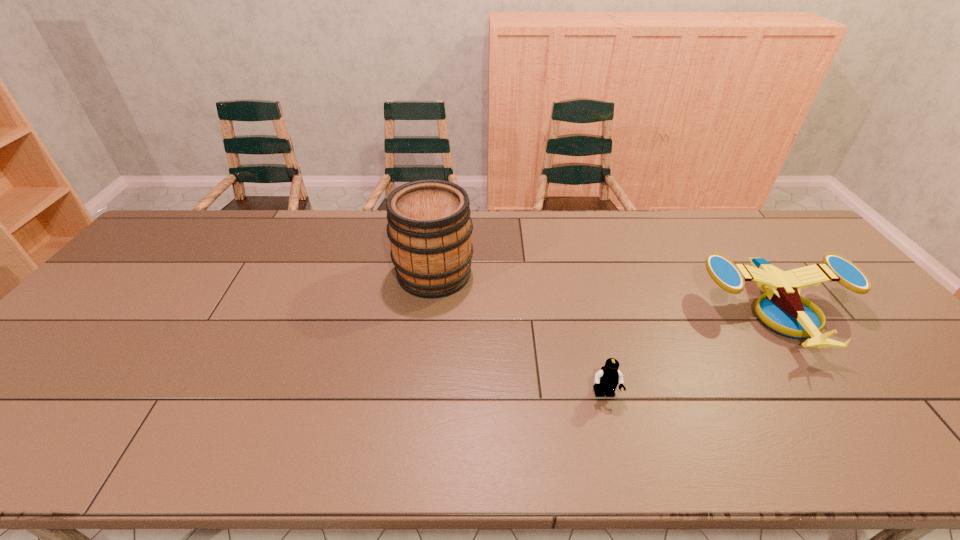
Image resolution: width=960 pixels, height=540 pixels. In the image, there is a desktop. Find the location of `vacant space at the far edge`. vacant space at the far edge is located at coordinates (263, 217).

Identify the location of free space at the near edge of the desktop. (422, 448).

You are a GUI agent. You are given a task and a screenshot of the screen. Output one action in this format:
    pyautogui.click(x=<x>, y=<y>)
    Task: Click on the free space at the right edge of the desktop
    This screenshot has width=960, height=540.
    Given the screenshot: What is the action you would take?
    pyautogui.click(x=919, y=374)

The height and width of the screenshot is (540, 960). I want to click on vacant space at the far left corner, so click(194, 234).

I want to click on vacant area that lies between the cider and the rightmost object, so click(606, 293).

Where is `free spot between the drone and the cider`? The height and width of the screenshot is (540, 960). free spot between the drone and the cider is located at coordinates (606, 293).

Where is `free space that is in between the second object from left to right and the rightmost object`? The image size is (960, 540). free space that is in between the second object from left to right and the rightmost object is located at coordinates (691, 354).

The height and width of the screenshot is (540, 960). What are the coordinates of `free space that is in between the nearest object and the tallest object` in the screenshot? It's located at (519, 334).

What are the coordinates of `unoccupied position between the nearest object and the drone` in the screenshot? It's located at (691, 354).

Identify the location of free spot between the nearest object and the rightmost object. (691, 354).